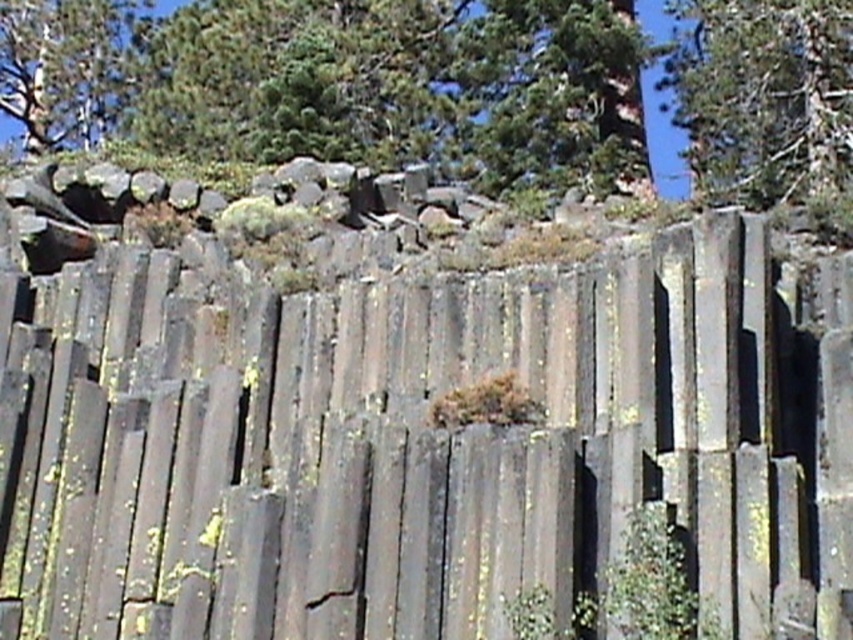
Which is behind, point (490, 157) or point (22, 128)?

Point (22, 128)

Between green leafy tree at upper center and green textured tree at upper left, which one appears on the right side from the viewer's perspective?

green leafy tree at upper center is more to the right.

Which is in front, point (488, 49) or point (36, 36)?

Point (488, 49)

At what (x,y) coordinates should I click in order to perform the action: click on green leafy tree at upper center. Please return your answer as a coordinate pair (x, y). Looking at the image, I should click on (553, 93).

Is point (257, 580) closer to viewer compared to point (815, 122)?

That is True.

Measure the distance between gray stone columns at center and camera.

A distance of 56.16 feet exists between gray stone columns at center and camera.

At what (x,y) coordinates should I click in order to perform the action: click on gray stone columns at center. Please return your answer as a coordinate pair (x, y). Looking at the image, I should click on (419, 444).

Can you confirm if green leafy tree at upper right is taller than green leafy tree at upper center?

Indeed, green leafy tree at upper right has a greater height compared to green leafy tree at upper center.

Who is higher up, green leafy tree at upper right or green leafy tree at upper center?

Positioned higher is green leafy tree at upper center.

Is point (724, 38) positioned in front of point (479, 86)?

Yes, it is.

The height and width of the screenshot is (640, 853). I want to click on green leafy tree at upper right, so click(766, 100).